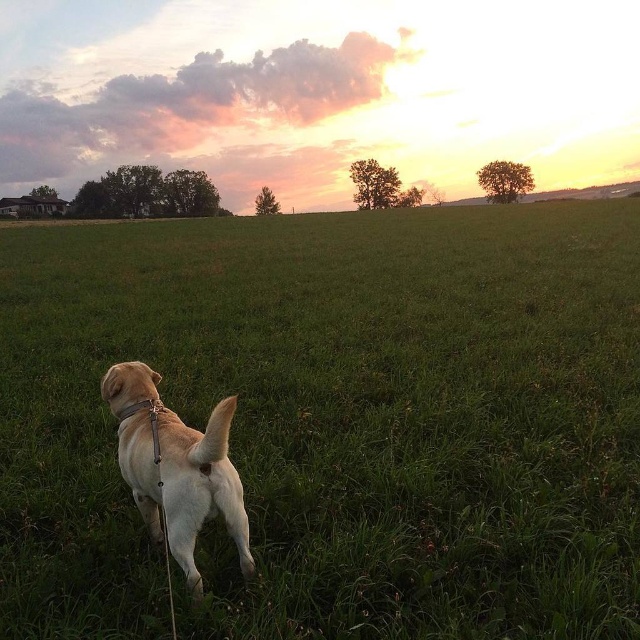
Is green grassy field at center thinner than golden fur dog at center?

Incorrect, green grassy field at center's width is not less than golden fur dog at center's.

Does green grassy field at center appear over golden fur dog at center?

Yes, green grassy field at center is above golden fur dog at center.

The height and width of the screenshot is (640, 640). What are the coordinates of `green grassy field at center` in the screenshot? It's located at (333, 420).

The width and height of the screenshot is (640, 640). In order to click on green grassy field at center in this screenshot , I will do [333, 420].